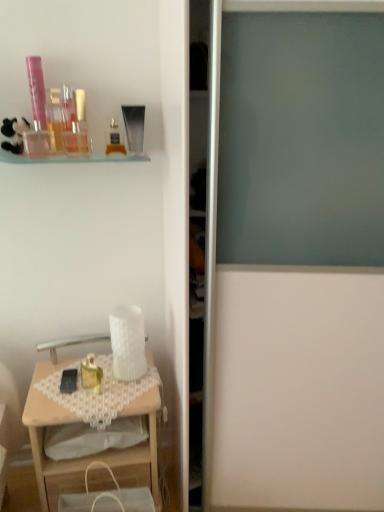
Question: Is wooden desk at lower left smaller than pink plastic tube at upper left, which is the 8th toiletry from bottom to top?

Choices:
 (A) no
 (B) yes

Answer: (A)

Question: Is wooden desk at lower left further to camera compared to pink plastic tube at upper left, which is the 8th toiletry from bottom to top?

Choices:
 (A) yes
 (B) no

Answer: (B)

Question: Considering the relative sizes of wooden desk at lower left and pink plastic tube at upper left, which is the 8th toiletry from bottom to top, in the image provided, is wooden desk at lower left taller than pink plastic tube at upper left, which is the 8th toiletry from bottom to top,?

Choices:
 (A) yes
 (B) no

Answer: (A)

Question: Does wooden desk at lower left have a lesser width compared to pink plastic tube at upper left, which is the 8th toiletry from bottom to top?

Choices:
 (A) no
 (B) yes

Answer: (A)

Question: Can you confirm if wooden desk at lower left is wider than pink plastic tube at upper left, which is the 8th toiletry from bottom to top?

Choices:
 (A) no
 (B) yes

Answer: (B)

Question: Is point (39, 93) positioned closer to the camera than point (77, 139)?

Choices:
 (A) closer
 (B) farther

Answer: (A)

Question: From a real-world perspective, is pink plastic tube at upper left, which is the 8th toiletry from bottom to top, physically located above or below matte gold perfume at upper left, which is the 6th toiletry from bottom to top?

Choices:
 (A) below
 (B) above

Answer: (B)

Question: Is pink plastic tube at upper left, which is the first toiletry in top-to-bottom order, spatially inside matte gold perfume at upper left, which is the 6th toiletry from bottom to top, or outside of it?

Choices:
 (A) outside
 (B) inside

Answer: (A)

Question: Looking at their shapes, would you say pink plastic tube at upper left, which is the 8th toiletry from bottom to top, is wider or thinner than matte gold perfume at upper left, which is counted as the third toiletry, starting from the top?

Choices:
 (A) wide
 (B) thin

Answer: (B)

Question: Does point (28, 138) appear closer or farther from the camera than point (97, 388)?

Choices:
 (A) farther
 (B) closer

Answer: (B)

Question: From the image's perspective, is matte plastic perfume bottle at upper left, placed as the seventh toiletry when sorted from top to bottom, located above or below gold metallic perfume at lower left, placed as the first toiletry when sorted from bottom to top?

Choices:
 (A) above
 (B) below

Answer: (A)

Question: In terms of width, does matte plastic perfume bottle at upper left, placed as the seventh toiletry when sorted from top to bottom, look wider or thinner when compared to gold metallic perfume at lower left, placed as the first toiletry when sorted from bottom to top?

Choices:
 (A) wide
 (B) thin

Answer: (B)

Question: In the image, is matte plastic perfume bottle at upper left, placed as the seventh toiletry when sorted from top to bottom, on the left side or the right side of gold metallic perfume at lower left, placed as the first toiletry when sorted from bottom to top?

Choices:
 (A) left
 (B) right

Answer: (A)

Question: Is point (137, 473) closer or farther from the camera than point (84, 370)?

Choices:
 (A) closer
 (B) farther

Answer: (A)

Question: Visually, is wooden desk at lower left positioned to the left or to the right of gold metallic perfume at lower left, placed as the first toiletry when sorted from bottom to top?

Choices:
 (A) left
 (B) right

Answer: (A)